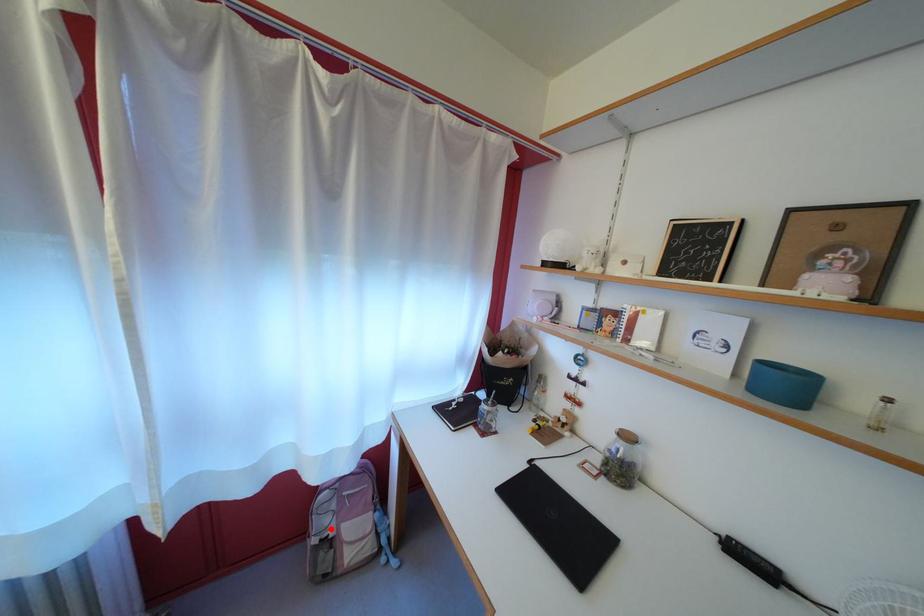
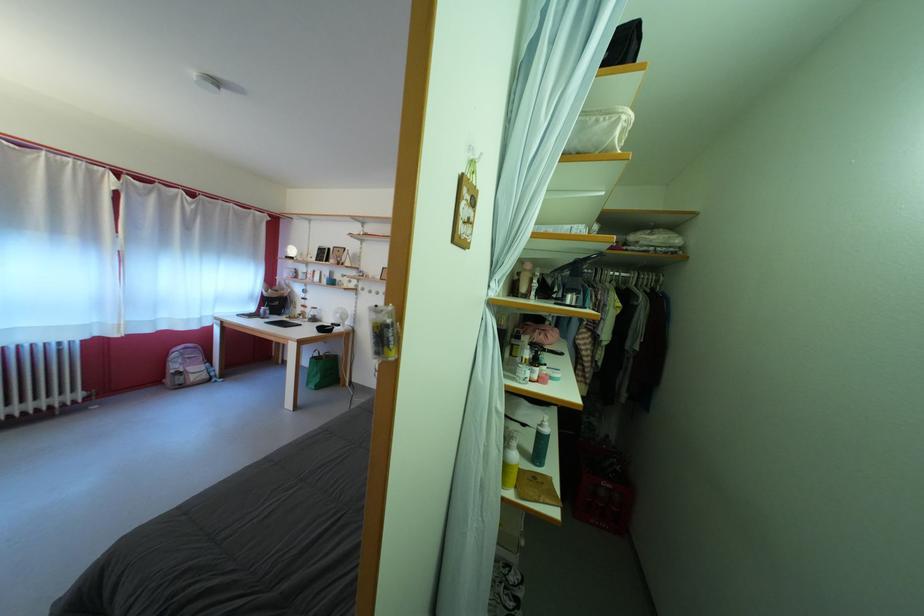
Question: I am providing you with two images of the same scene from different viewpoints. In image1, a red point is highlighted. Considering the same 3D point in image2, which of the following is correct?

Choices:
 (A) It is closer
 (B) It is farther

Answer: (A)